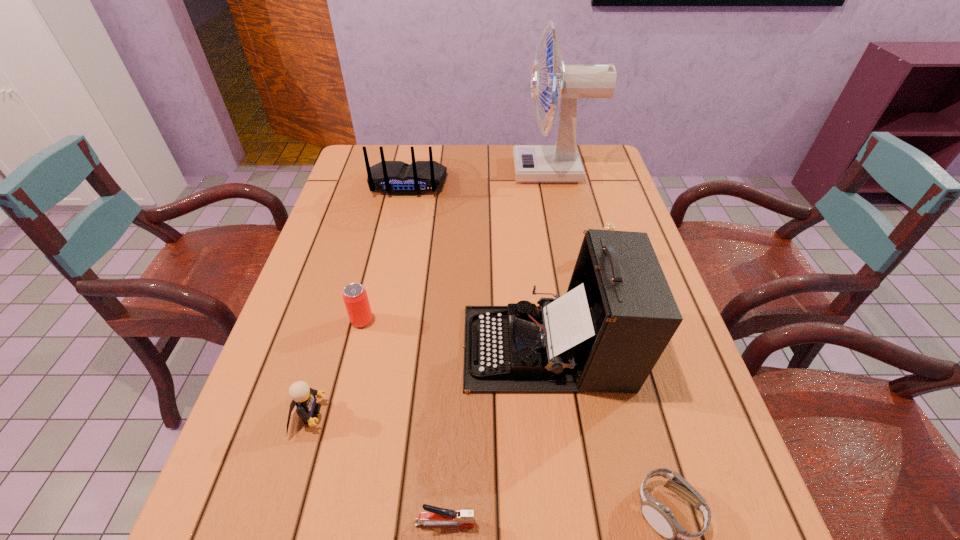
This screenshot has width=960, height=540. What are the coordinates of `vacant space situated 0.200m on the front-facing side of the tallest object` in the screenshot? It's located at (453, 171).

Find the location of a particular element. blank space located inside the open case of the seventh shortest object is located at coordinates (324, 348).

Where is `vacant space positioned inside the open case of the seventh shortest object`? vacant space positioned inside the open case of the seventh shortest object is located at coordinates (319, 348).

Identify the location of vacant region located 0.270m inside the open case of the seventh shortest object. (337, 348).

At what (x,y) coordinates should I click in order to perform the action: click on vacant point located on the back of the third tallest object. Please return your answer as a coordinate pair (x, y). Looking at the image, I should click on [x=392, y=259].

Locate an element on the screen. The width and height of the screenshot is (960, 540). vacant space located 0.110m on the front-facing side of the right Lego is located at coordinates (612, 290).

Find the location of a particular element. Image resolution: width=960 pixels, height=540 pixels. free point located 0.070m on the left of the beer can is located at coordinates (320, 321).

You are a GUI agent. You are given a task and a screenshot of the screen. Output one action in this format:
    pyautogui.click(x=<x>, y=<y>)
    Task: Click on the vacant space located on the front-facing side of the nearer Lego
    This screenshot has height=540, width=960.
    Given the screenshot: What is the action you would take?
    pyautogui.click(x=389, y=415)

You are a GUI agent. You are given a task and a screenshot of the screen. Output one action in this format:
    pyautogui.click(x=<x>, y=<y>)
    Task: Click on the vacant region located 0.160m on the handle side of the stapler
    
    Given the screenshot: What is the action you would take?
    (x=574, y=523)

You are a GUI agent. You are given a task and a screenshot of the screen. Output one action in this format:
    pyautogui.click(x=<x>, y=<y>)
    Task: Click on the fan that is at the far edge
    This screenshot has height=540, width=960.
    Given the screenshot: What is the action you would take?
    pyautogui.click(x=560, y=163)